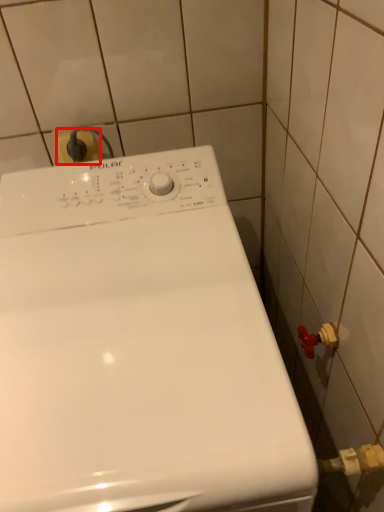
Question: From the image's perspective, considering the relative positions of electric outlet (annotated by the red box) and washing machine in the image provided, where is electric outlet (annotated by the red box) located with respect to the staircase?

Choices:
 (A) above
 (B) below

Answer: (A)